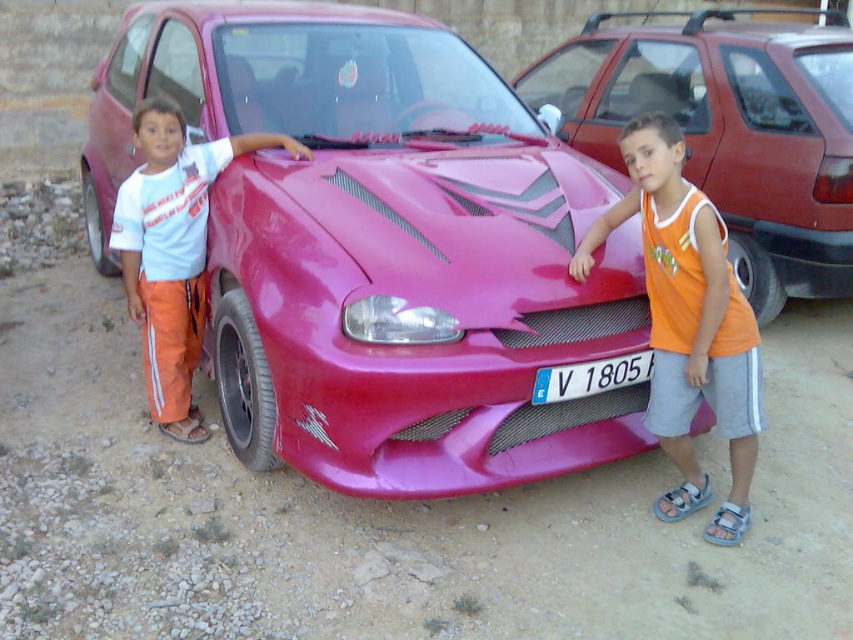
Question: Which point is closer to the camera?

Choices:
 (A) orange fabric shirt at center
 (B) white cotton shirt at left
 (C) shiny pink car at center

Answer: (C)

Question: From the image, what is the correct spatial relationship of shiny pink car at center in relation to white cotton shirt at left?

Choices:
 (A) above
 (B) below

Answer: (A)

Question: Can you confirm if shiny pink car at center is positioned to the left of orange fabric shirt at center?

Choices:
 (A) yes
 (B) no

Answer: (A)

Question: Which object appears closest to the camera in this image?

Choices:
 (A) orange fabric shirt at center
 (B) white cotton shirt at left
 (C) white plastic license plate at center
 (D) glossy pink car at center

Answer: (A)

Question: Which of the following is the closest to the observer?

Choices:
 (A) white cotton shirt at left
 (B) white plastic license plate at center
 (C) orange fabric shirt at center
 (D) glossy pink car at center

Answer: (C)

Question: Does orange fabric shirt at center appear under white plastic license plate at center?

Choices:
 (A) yes
 (B) no

Answer: (B)